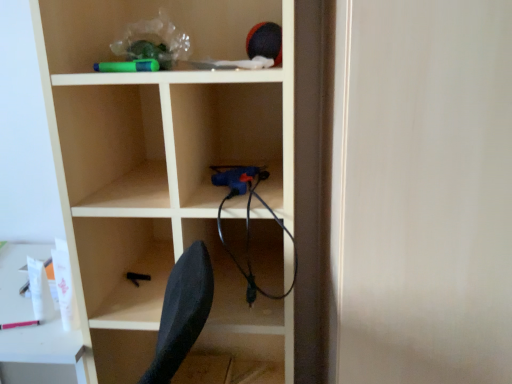
Question: Considering the positions of wooden shelf at center and white glossy table at lower left in the image, is wooden shelf at center wider or thinner than white glossy table at lower left?

Choices:
 (A) thin
 (B) wide

Answer: (A)

Question: In terms of height, does wooden shelf at center look taller or shorter compared to white glossy table at lower left?

Choices:
 (A) short
 (B) tall

Answer: (B)

Question: In the image, is wooden shelf at center on the left side or the right side of white glossy table at lower left?

Choices:
 (A) right
 (B) left

Answer: (A)

Question: Is white glossy table at lower left spatially inside wooden shelf at center, or outside of it?

Choices:
 (A) inside
 (B) outside

Answer: (B)

Question: In the image, is white glossy table at lower left positioned in front of or behind wooden shelf at center?

Choices:
 (A) behind
 (B) front

Answer: (A)

Question: Looking at their shapes, would you say white glossy table at lower left is wider or thinner than wooden shelf at center?

Choices:
 (A) wide
 (B) thin

Answer: (A)

Question: Considering the relative positions of white glossy table at lower left and wooden shelf at center in the image provided, is white glossy table at lower left to the left or to the right of wooden shelf at center?

Choices:
 (A) left
 (B) right

Answer: (A)